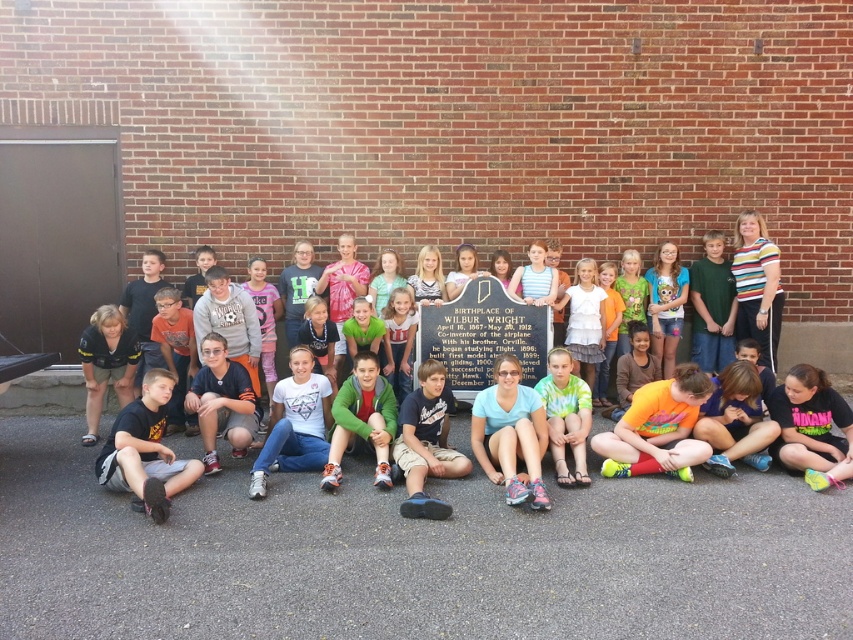
Question: Is light blue t-shirt at center above tie-dye fabric shorts at center?

Choices:
 (A) no
 (B) yes

Answer: (A)

Question: Is dark blue denim shorts at left closer to the viewer compared to green tie-dye shirt at center?

Choices:
 (A) no
 (B) yes

Answer: (B)

Question: Is light blue t-shirt at center positioned behind green tie-dye shirt at center?

Choices:
 (A) yes
 (B) no

Answer: (B)

Question: Among these objects, which one is farthest from the camera?

Choices:
 (A) tie-dye fabric shorts at center
 (B) dark blue denim shorts at left
 (C) green tie-dye shirt at center
 (D) light blue t-shirt at center

Answer: (C)

Question: Which point is farther from the camera taking this photo?

Choices:
 (A) (844, 349)
 (B) (584, 448)
 (C) (479, 452)

Answer: (A)

Question: Which point is farther from the camera taking this photo?

Choices:
 (A) (570, 422)
 (B) (94, 362)
 (C) (508, 426)
 (D) (850, 324)

Answer: (D)